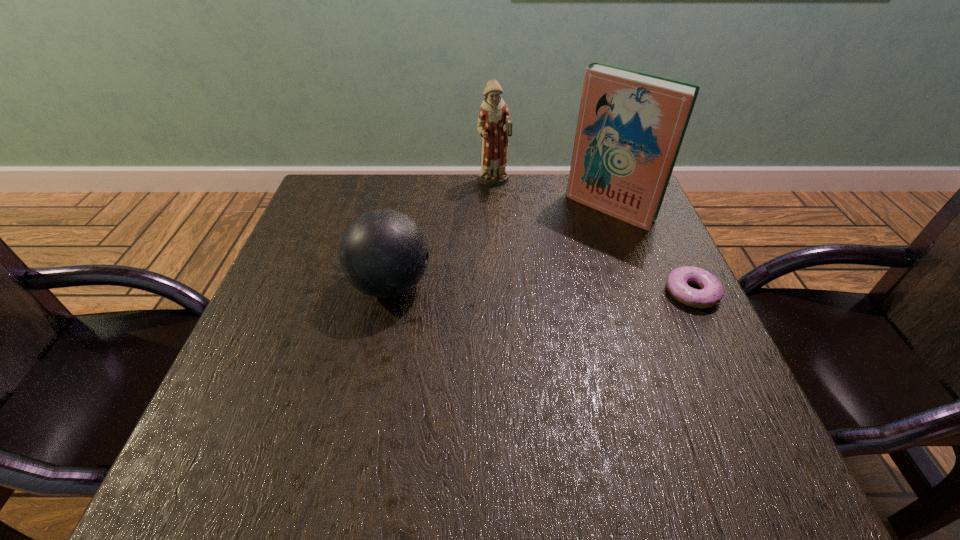
Where is `vacant space located 0.090m on the cover of the tallest object`? This screenshot has height=540, width=960. vacant space located 0.090m on the cover of the tallest object is located at coordinates (572, 244).

Where is `vacant space situated 0.190m on the front-facing side of the third shortest object`? vacant space situated 0.190m on the front-facing side of the third shortest object is located at coordinates (516, 232).

This screenshot has height=540, width=960. I want to click on free location located on the front-facing side of the third shortest object, so click(533, 267).

I want to click on free space located on the front-facing side of the third shortest object, so click(505, 207).

The width and height of the screenshot is (960, 540). What are the coordinates of `hardback book that is at the far edge` in the screenshot? It's located at (631, 125).

Locate an element on the screen. The width and height of the screenshot is (960, 540). figurine that is at the far edge is located at coordinates (494, 125).

Image resolution: width=960 pixels, height=540 pixels. I want to click on doughnut that is positioned at the right edge, so click(x=711, y=292).

Find the location of a particular element. The image size is (960, 540). hardback book present at the right edge is located at coordinates (631, 125).

Image resolution: width=960 pixels, height=540 pixels. Identify the location of object at the far right corner. (631, 125).

Where is `free spot at the far edge of the desktop`? This screenshot has height=540, width=960. free spot at the far edge of the desktop is located at coordinates (518, 224).